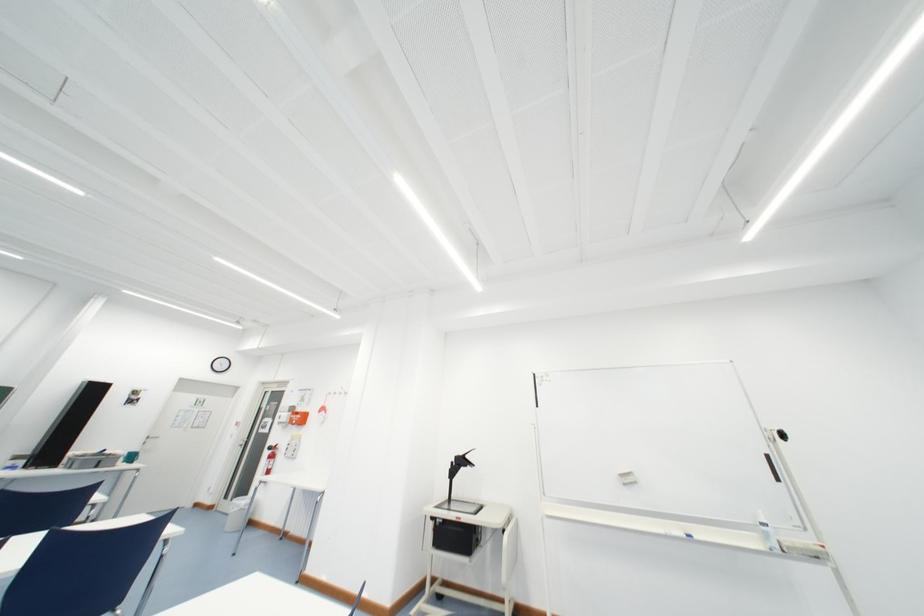
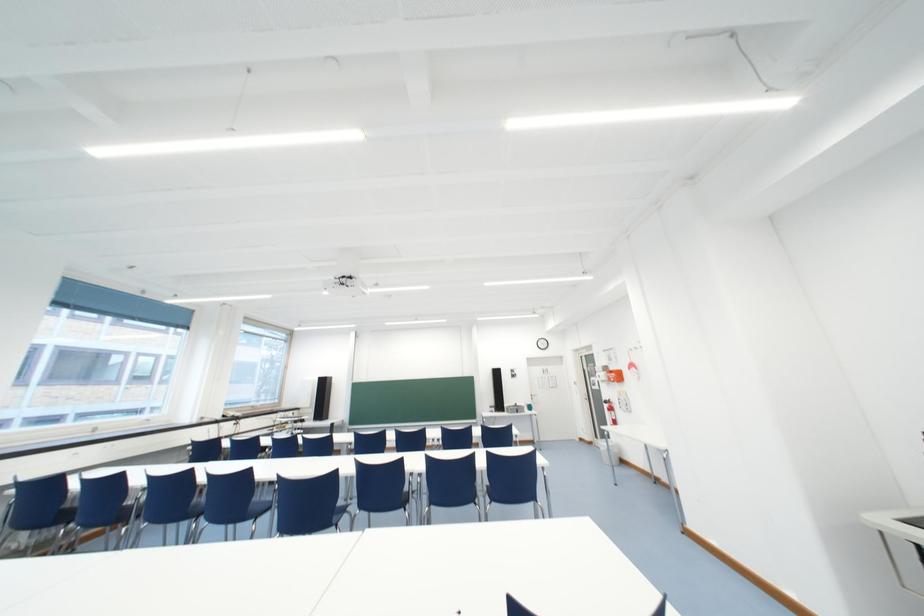
Question: Based on the continuous images, in which direction is the camera rotating? Reply with the corresponding letter.

Choices:
 (A) Left
 (B) Right
 (C) Up
 (D) Down

Answer: (A)